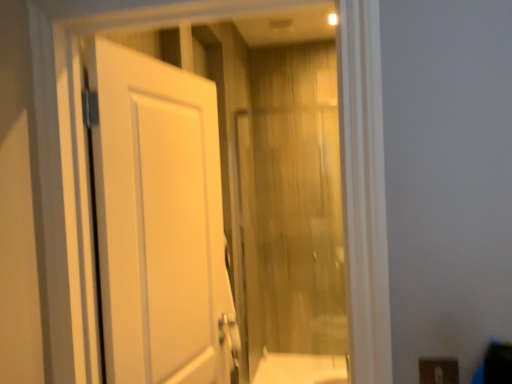
Question: Does brown matte electric outlet at lower right lie in front of white matte door at left?

Choices:
 (A) no
 (B) yes

Answer: (B)

Question: From the image's perspective, does brown matte electric outlet at lower right appear lower than white matte door at left?

Choices:
 (A) no
 (B) yes

Answer: (B)

Question: Does brown matte electric outlet at lower right have a smaller size compared to white matte door at left?

Choices:
 (A) yes
 (B) no

Answer: (A)

Question: Can you confirm if brown matte electric outlet at lower right is thinner than white matte door at left?

Choices:
 (A) yes
 (B) no

Answer: (A)

Question: Can you confirm if brown matte electric outlet at lower right is shorter than white matte door at left?

Choices:
 (A) no
 (B) yes

Answer: (B)

Question: Is brown matte electric outlet at lower right looking in the opposite direction of white matte door at left?

Choices:
 (A) no
 (B) yes

Answer: (A)

Question: Considering the relative positions of white matte door at left and translucent wood curtain at center in the image provided, is white matte door at left to the right of translucent wood curtain at center from the viewer's perspective?

Choices:
 (A) yes
 (B) no

Answer: (B)

Question: Is white matte door at left wider than translucent wood curtain at center?

Choices:
 (A) yes
 (B) no

Answer: (A)

Question: From the image's perspective, is white matte door at left beneath translucent wood curtain at center?

Choices:
 (A) no
 (B) yes

Answer: (A)

Question: Can you confirm if white matte door at left is smaller than translucent wood curtain at center?

Choices:
 (A) no
 (B) yes

Answer: (A)

Question: Can you confirm if white matte door at left is positioned to the left of translucent wood curtain at center?

Choices:
 (A) no
 (B) yes

Answer: (B)

Question: Can you confirm if white matte door at left is bigger than translucent wood curtain at center?

Choices:
 (A) yes
 (B) no

Answer: (A)

Question: Is translucent wood curtain at center positioned before white matte door at left?

Choices:
 (A) yes
 (B) no

Answer: (B)